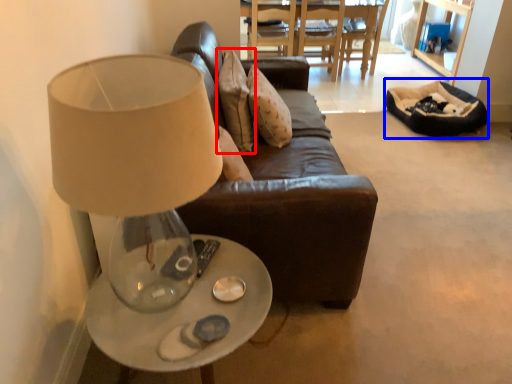
Question: Which object appears closest to the camera in this image, pillow (highlighted by a red box) or bean bag chair (highlighted by a blue box)?

Choices:
 (A) pillow
 (B) bean bag chair

Answer: (A)